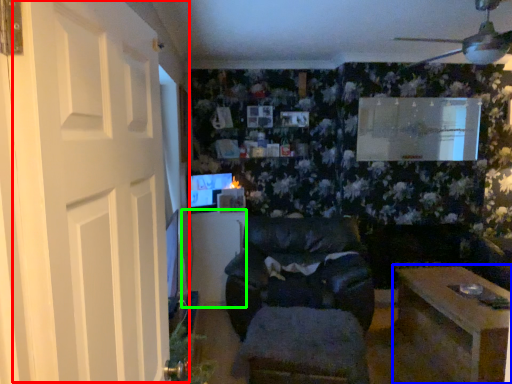
Question: Which is farther away from door (highlighted by a red box)? table (highlighted by a blue box) or table (highlighted by a green box)?

Choices:
 (A) table
 (B) table

Answer: (B)